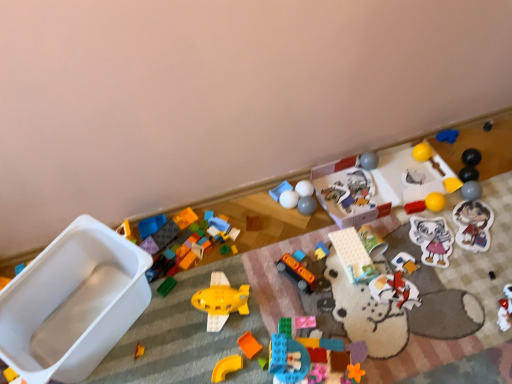
Find the location of a particular element. The height and width of the screenshot is (384, 512). vacant area on top of white plastic toy at center, which is the seventeenth toy from left to right (from a real-world perspective) is located at coordinates (359, 189).